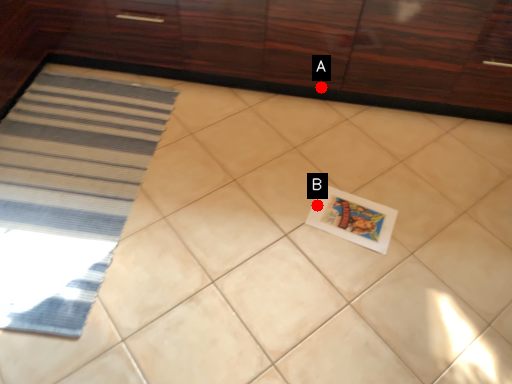
Question: Two points are circled on the image, labeled by A and B beside each circle. Among these points, which one is nearest to the camera?

Choices:
 (A) A is closer
 (B) B is closer

Answer: (B)